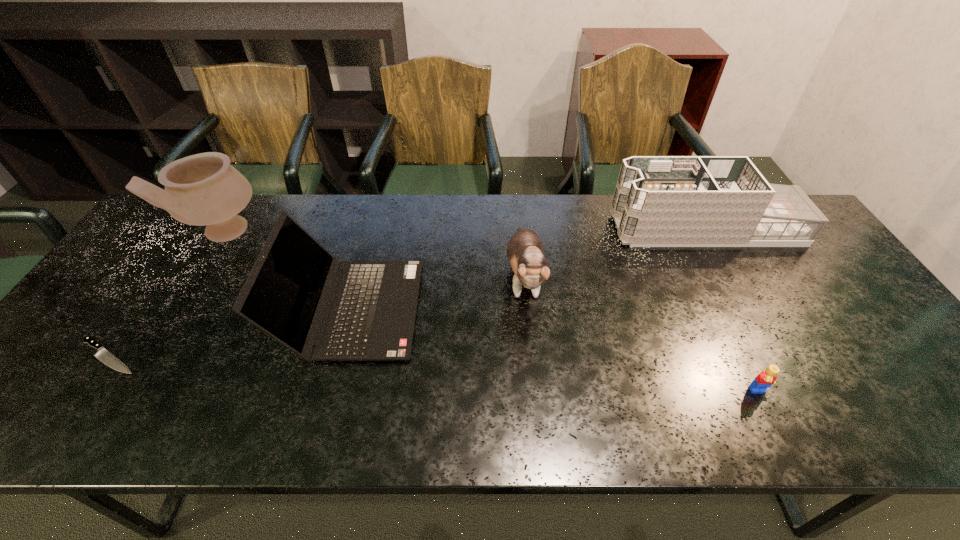
You are a GUI agent. You are given a task and a screenshot of the screen. Output one action in this format:
    pyautogui.click(x=<x>, y=<y>)
    Task: Click on the tallest object
    
    Given the screenshot: What is the action you would take?
    pyautogui.click(x=203, y=189)

Where is `cat`? cat is located at coordinates (525, 251).

Identify the location of dollhouse. click(659, 201).

Where is `the fourth object from right to left`? The width and height of the screenshot is (960, 540). the fourth object from right to left is located at coordinates (298, 293).

I want to click on the second shortest object, so click(x=765, y=379).

Locate an element on the screen. This screenshot has height=540, width=960. the nearest object is located at coordinates (765, 379).

This screenshot has height=540, width=960. Find the location of `the shortest object`. the shortest object is located at coordinates (102, 354).

Where is `free space located on the front of the tallest object`? This screenshot has height=540, width=960. free space located on the front of the tallest object is located at coordinates coord(176,312).

In order to click on vacant space located at the face of the cat in this screenshot , I will do `click(537, 416)`.

Find the location of a particular element. The height and width of the screenshot is (540, 960). vacant area located 0.090m at the entrance of the dollhouse is located at coordinates (584, 228).